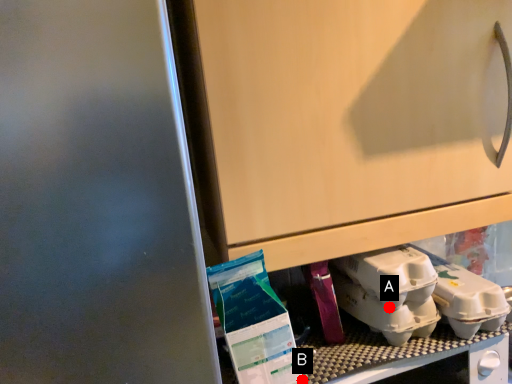
Question: Two points are circled on the image, labeled by A and B beside each circle. Which point appears closest to the camera in this image?

Choices:
 (A) A is closer
 (B) B is closer

Answer: (B)